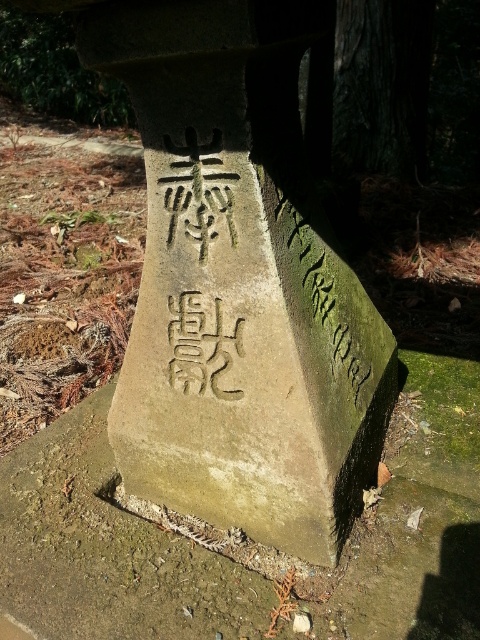
Question: Is green stone marker at center smaller than green mossy stone at center?

Choices:
 (A) no
 (B) yes

Answer: (A)

Question: Can you confirm if green stone marker at center is positioned to the right of green mossy stone at center?

Choices:
 (A) no
 (B) yes

Answer: (A)

Question: Is green stone marker at center bigger than green mossy stone at center?

Choices:
 (A) yes
 (B) no

Answer: (A)

Question: Which point is closer to the camera?

Choices:
 (A) (290, 307)
 (B) (90, 554)

Answer: (A)

Question: Which object is closer to the camera taking this photo?

Choices:
 (A) green stone marker at center
 (B) green mossy stone at center

Answer: (A)